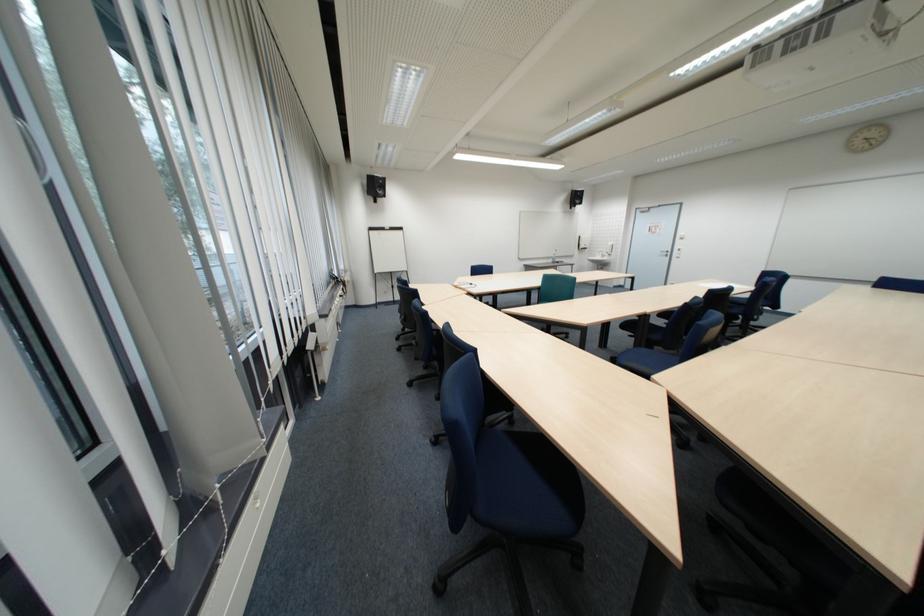
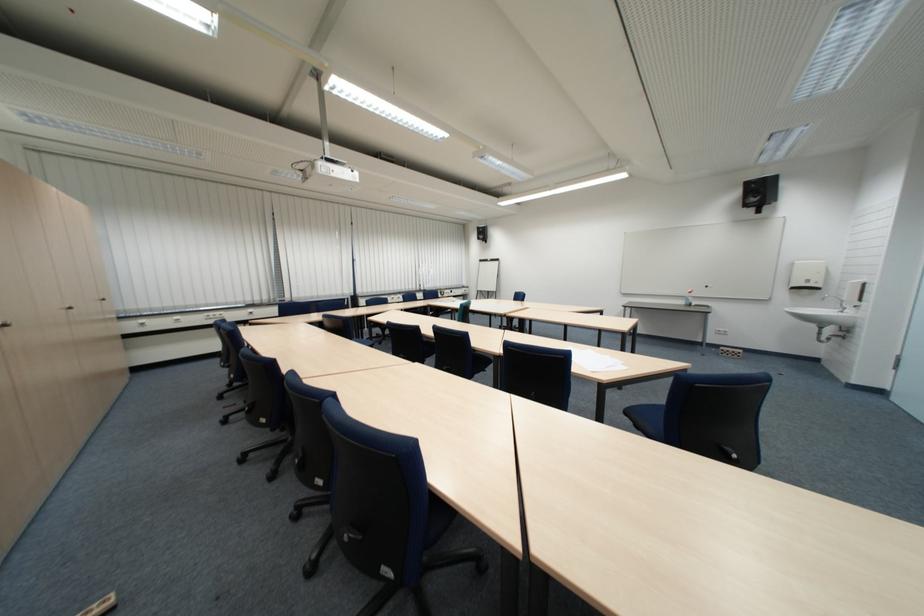
The point at [565,262] is marked in the first image. Where is the corresponding point in the second image?

(696, 302)